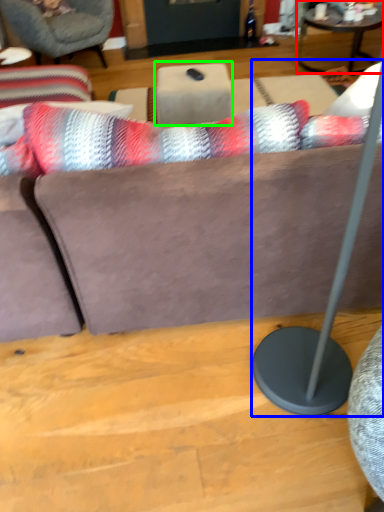
Question: Estimate the real-world distances between objects in this image. Which object is farther from coffee table (highlighted by a red box), table lamp (highlighted by a blue box) or table (highlighted by a green box)?

Choices:
 (A) table lamp
 (B) table

Answer: (A)